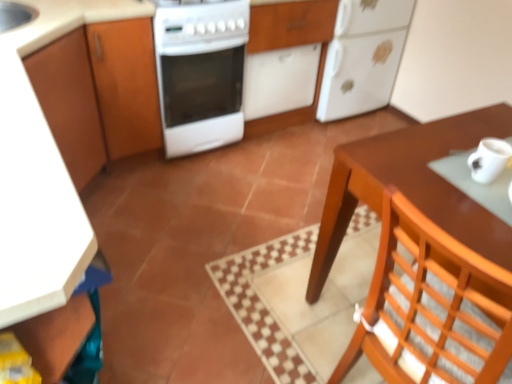
Question: Does brown wooden table at right have a greater width compared to wooden chair at lower right?

Choices:
 (A) yes
 (B) no

Answer: (A)

Question: Could you tell me if brown wooden table at right is facing wooden chair at lower right?

Choices:
 (A) no
 (B) yes

Answer: (A)

Question: Does brown wooden table at right have a smaller size compared to wooden chair at lower right?

Choices:
 (A) yes
 (B) no

Answer: (B)

Question: From the image's perspective, would you say brown wooden table at right is positioned over wooden chair at lower right?

Choices:
 (A) yes
 (B) no

Answer: (A)

Question: Would you say wooden chair at lower right is part of brown wooden table at right's contents?

Choices:
 (A) yes
 (B) no

Answer: (B)

Question: From a real-world perspective, is wooden chair at lower right positioned above or below wooden cabinet at left, the second cabinetry in the right-to-left sequence?

Choices:
 (A) below
 (B) above

Answer: (B)

Question: Relative to wooden cabinet at left, which is counted as the 1th cabinetry, starting from the left, is wooden chair at lower right in front or behind?

Choices:
 (A) front
 (B) behind

Answer: (A)

Question: From their relative heights in the image, would you say wooden chair at lower right is taller or shorter than wooden cabinet at left, the second cabinetry in the right-to-left sequence?

Choices:
 (A) short
 (B) tall

Answer: (B)

Question: Does point (366, 314) appear closer or farther from the camera than point (55, 140)?

Choices:
 (A) farther
 (B) closer

Answer: (B)

Question: Does point (342, 152) appear closer or farther from the camera than point (202, 79)?

Choices:
 (A) farther
 (B) closer

Answer: (B)

Question: Considering the positions of brown wooden table at right and white glossy stove at center in the image, is brown wooden table at right bigger or smaller than white glossy stove at center?

Choices:
 (A) big
 (B) small

Answer: (A)

Question: Looking at their shapes, would you say brown wooden table at right is wider or thinner than white glossy stove at center?

Choices:
 (A) thin
 (B) wide

Answer: (B)

Question: Considering their positions, is brown wooden table at right located in front of or behind white glossy stove at center?

Choices:
 (A) behind
 (B) front

Answer: (B)

Question: Based on their positions, is white matte mug at right located to the left or right of white matte cabinet at center, arranged as the first cabinetry when viewed from the right?

Choices:
 (A) left
 (B) right

Answer: (B)

Question: Considering their positions, is white matte mug at right located in front of or behind white matte cabinet at center, arranged as the first cabinetry when viewed from the right?

Choices:
 (A) behind
 (B) front

Answer: (B)